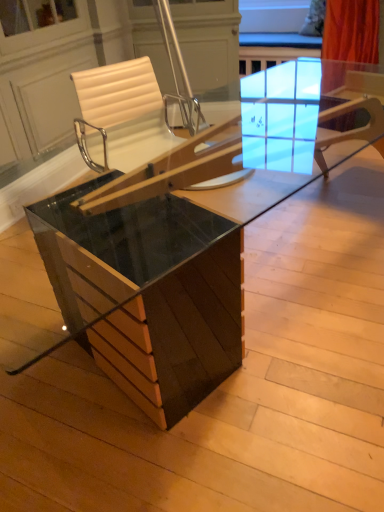
Question: From a real-world perspective, is glossy wood table at center over white leather chair at center?

Choices:
 (A) no
 (B) yes

Answer: (A)

Question: Could you tell me if glossy wood table at center is turned towards white leather chair at center?

Choices:
 (A) no
 (B) yes

Answer: (B)

Question: Is white leather chair at center surrounded by glossy wood table at center?

Choices:
 (A) no
 (B) yes

Answer: (A)

Question: Can you confirm if glossy wood table at center is thinner than white leather chair at center?

Choices:
 (A) no
 (B) yes

Answer: (A)

Question: Can you confirm if glossy wood table at center is positioned to the left of white leather chair at center?

Choices:
 (A) no
 (B) yes

Answer: (A)

Question: Are glossy wood table at center and white leather chair at center far apart?

Choices:
 (A) yes
 (B) no

Answer: (B)

Question: From the image's perspective, is white leather chair at center located beneath glossy wood table at center?

Choices:
 (A) no
 (B) yes

Answer: (A)

Question: Does white leather chair at center have a larger size compared to glossy wood table at center?

Choices:
 (A) yes
 (B) no

Answer: (B)

Question: From a real-world perspective, is white leather chair at center physically below glossy wood table at center?

Choices:
 (A) yes
 (B) no

Answer: (B)

Question: Does white leather chair at center have a greater width compared to glossy wood table at center?

Choices:
 (A) yes
 (B) no

Answer: (B)

Question: Considering the relative sizes of white leather chair at center and glossy wood table at center in the image provided, is white leather chair at center shorter than glossy wood table at center?

Choices:
 (A) yes
 (B) no

Answer: (B)

Question: Is glossy wood table at center completely or partially inside white leather chair at center?

Choices:
 (A) yes
 (B) no

Answer: (B)

Question: Considering their positions, is white leather chair at center located in front of or behind glossy wood table at center?

Choices:
 (A) behind
 (B) front

Answer: (A)